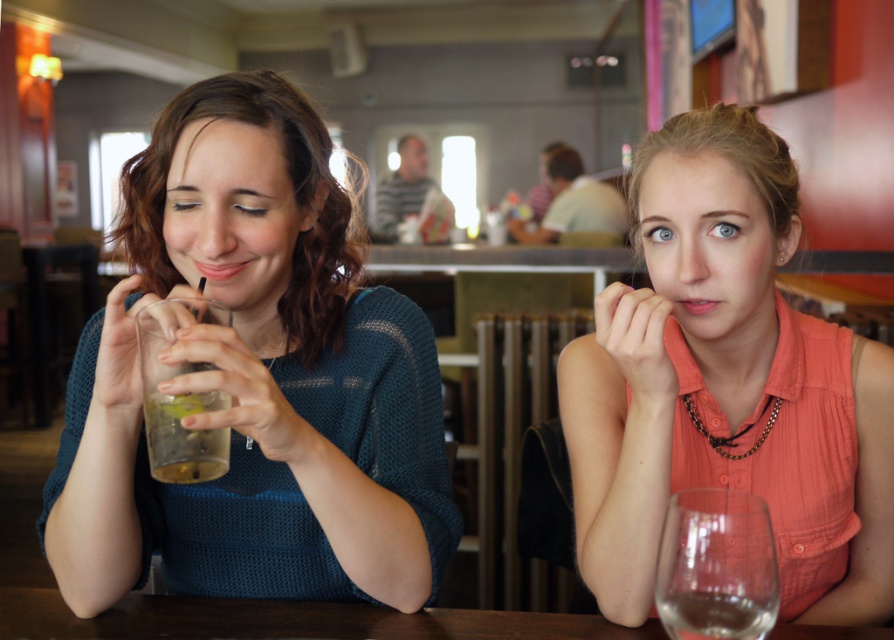
Based on the photo, you are a photographer trying to capture a candid shot of the matte glass at left and the matte orange blouse at center. Since you want both subjects in the frame, can you confirm if they are positioned side by side horizontally?

The matte glass at left is to the left of matte orange blouse at center, so they are positioned side by side horizontally from left to right.

You are a photographer taking a portrait of the two people at the table. You want to ensure the gold metallic necklace at center and the clear glass wine at right are both visible in the frame. Based on their positions, which object is closer to the bottom edge of the photo?

The clear glass wine at right is closer to the bottom edge of the photo because it is positioned below the gold metallic necklace at center.

You are taking a photo of the two people at the table. You want to focus on the person closer to the camera. Which point should you focus on, point (688, 612) or point (689, 401)?

You should focus on point (688, 612) because it is closer to the camera than point (689, 401).